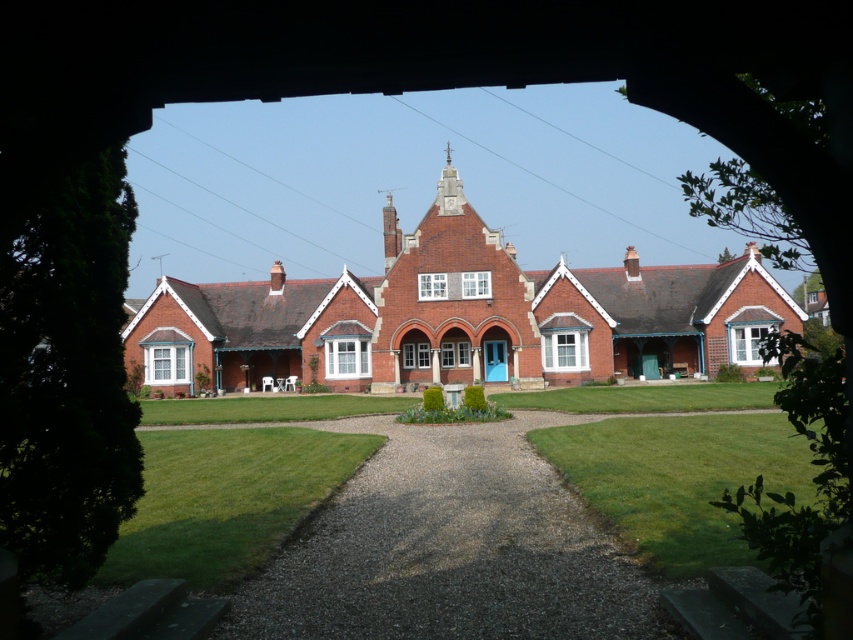
Question: Which of the following is the farthest from the observer?

Choices:
 (A) dark gray gravel driveway at center
 (B) green grass at lower center

Answer: (A)

Question: Is dark gray gravel driveway at center below green grass at lower left?

Choices:
 (A) yes
 (B) no

Answer: (B)

Question: Which object is the closest to the green grass at lower left?

Choices:
 (A) green grass at lower center
 (B) dark gray gravel driveway at center

Answer: (B)

Question: Based on their relative distances, which object is nearer to the green grass at lower center?

Choices:
 (A) green grass at lower left
 (B) dark gray gravel driveway at center

Answer: (B)

Question: Does dark gray gravel driveway at center appear over green grass at lower center?

Choices:
 (A) yes
 (B) no

Answer: (B)

Question: Does green grass at lower center appear under green grass at lower left?

Choices:
 (A) no
 (B) yes

Answer: (A)